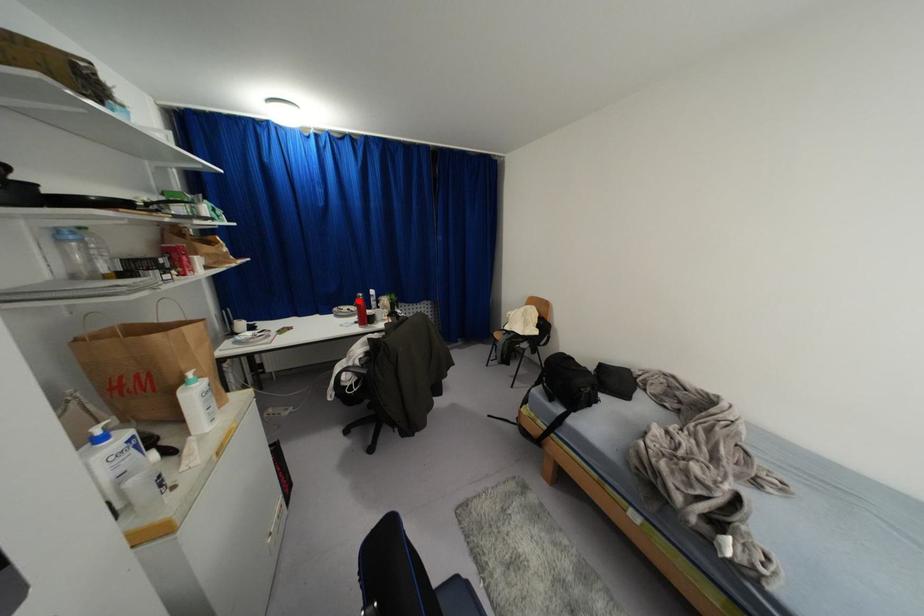
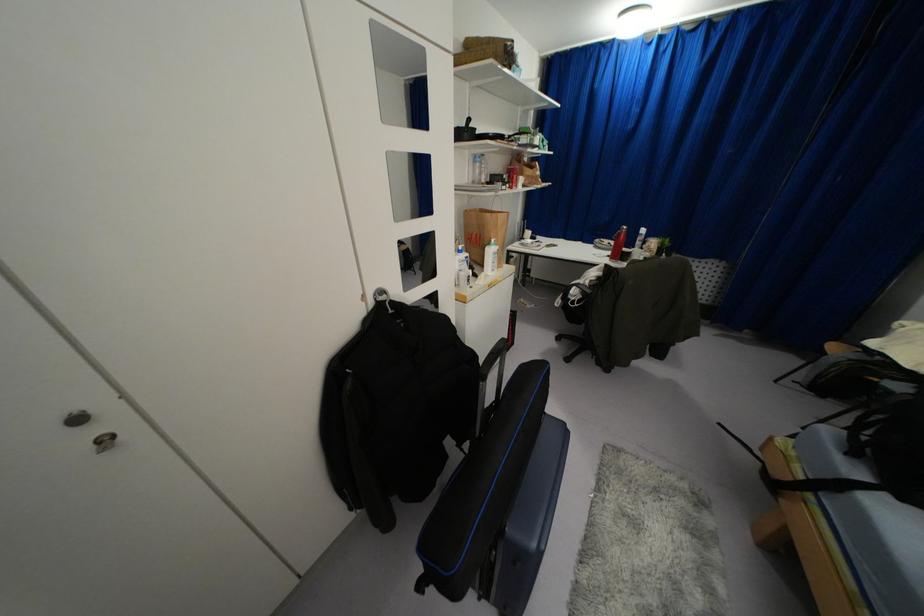
Question: I am providing you with two images of the same scene from different viewpoints. In image1, a red point is highlighted. Considering the same 3D point in image2, which of the following is correct?

Choices:
 (A) It is closer
 (B) It is farther

Answer: (A)